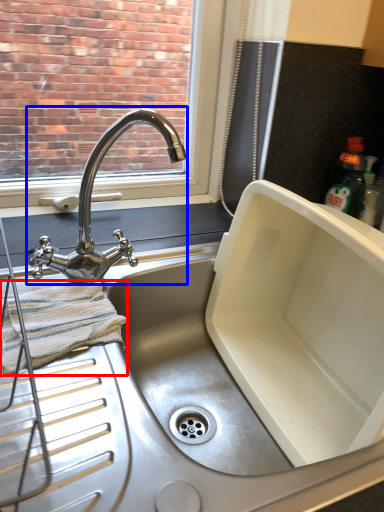
Question: Among these objects, which one is farthest to the camera, bath towel (highlighted by a red box) or tap (highlighted by a blue box)?

Choices:
 (A) bath towel
 (B) tap

Answer: (A)